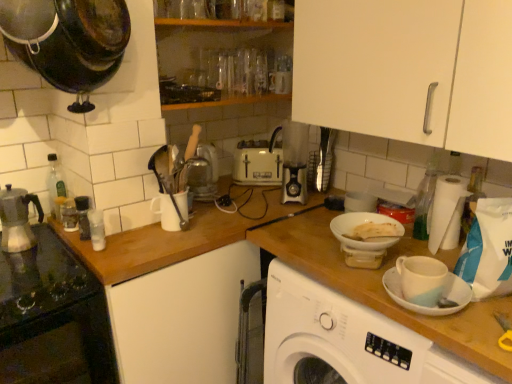
Locate an element on the screen. This screenshot has height=384, width=512. vacant space to the right of white matte bottle at left, which is counted as the second bottle, starting from the right is located at coordinates (134, 247).